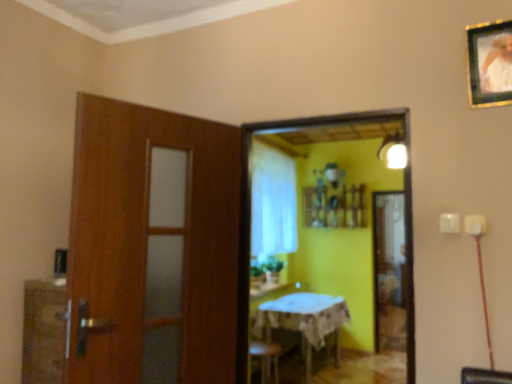
Identify the location of empty space that is ontop of wooden framed mirror at center (from a real-world perspective). Image resolution: width=512 pixels, height=384 pixels. (313, 111).